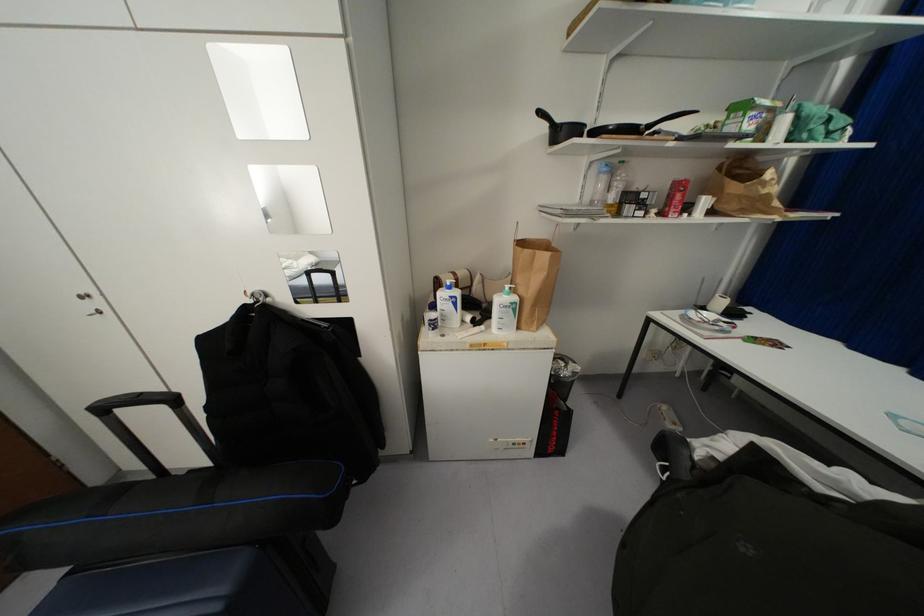
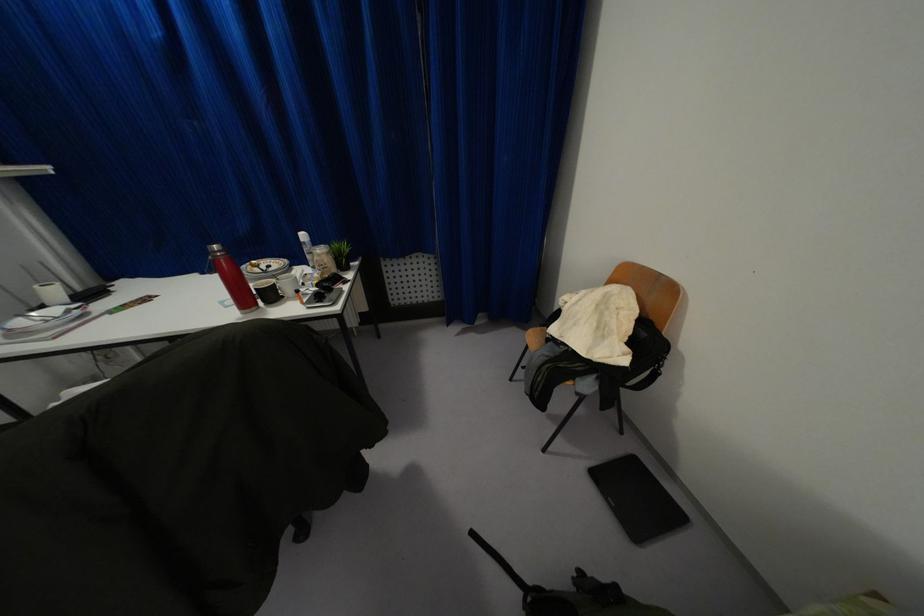
The images are taken continuously from a first-person perspective. In which direction is your viewpoint rotating?

The camera rotated toward right-down.